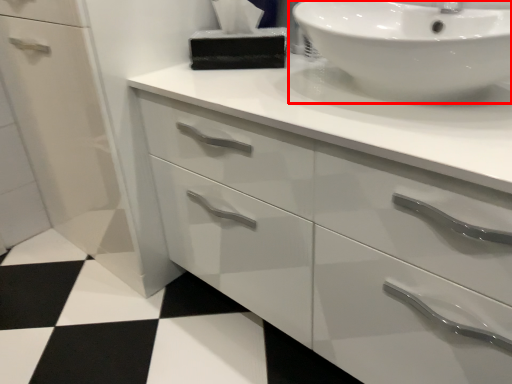
Question: From the image's perspective, where is sink (annotated by the red box) located in relation to tissue in the image?

Choices:
 (A) above
 (B) below

Answer: (B)